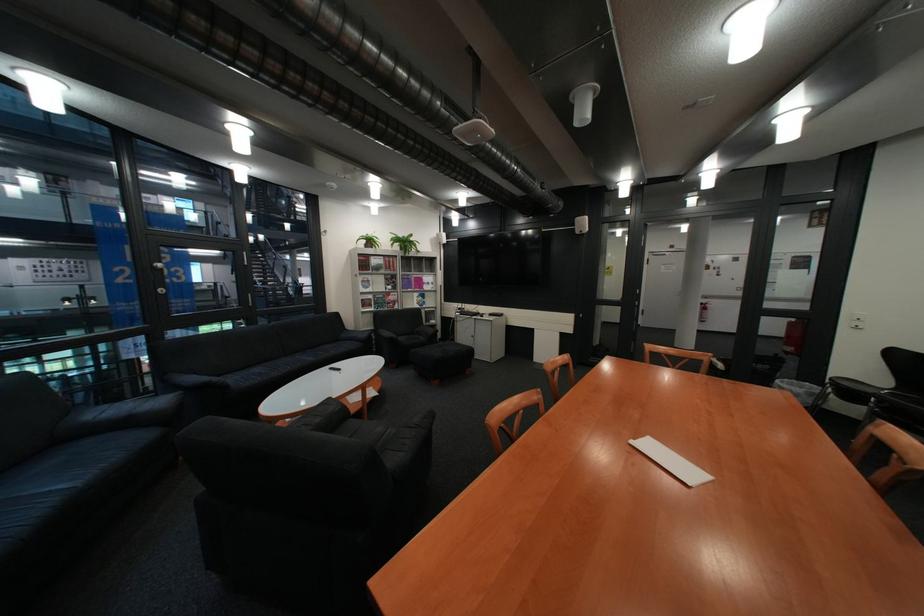
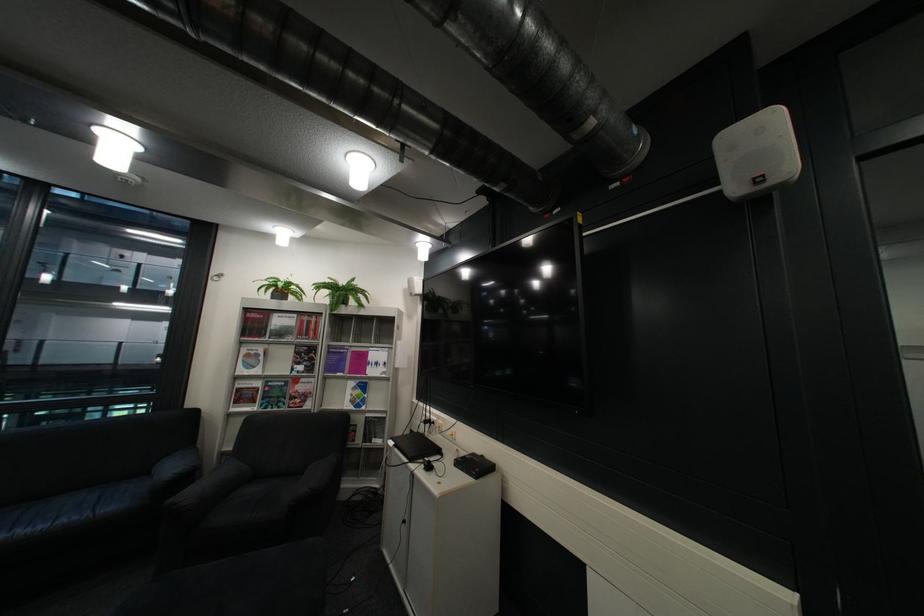
In the second image, find the point that corresponds to point (380, 241) in the first image.

(287, 290)